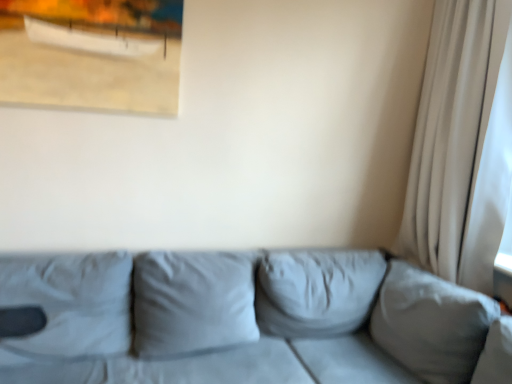
Question: From a real-world perspective, does white sheer curtain at right sit lower than suede gray couch at center?

Choices:
 (A) yes
 (B) no

Answer: (B)

Question: Is white sheer curtain at right in front of suede gray couch at center?

Choices:
 (A) no
 (B) yes

Answer: (A)

Question: From a real-world perspective, is white sheer curtain at right on top of suede gray couch at center?

Choices:
 (A) no
 (B) yes

Answer: (B)

Question: Is white sheer curtain at right far away from suede gray couch at center?

Choices:
 (A) no
 (B) yes

Answer: (A)

Question: Is suede gray couch at center located within white sheer curtain at right?

Choices:
 (A) no
 (B) yes

Answer: (A)

Question: From a real-world perspective, is white sheer curtain at right above or below matte wooden picture frame at upper left?

Choices:
 (A) above
 (B) below

Answer: (B)

Question: Do you think white sheer curtain at right is within matte wooden picture frame at upper left, or outside of it?

Choices:
 (A) inside
 (B) outside

Answer: (B)

Question: Considering the positions of point (467, 172) and point (108, 44), is point (467, 172) closer or farther from the camera than point (108, 44)?

Choices:
 (A) farther
 (B) closer

Answer: (A)

Question: Relative to matte wooden picture frame at upper left, is white sheer curtain at right in front or behind?

Choices:
 (A) behind
 (B) front

Answer: (B)

Question: Is suede gray couch at center to the left or to the right of white sheer curtain at right in the image?

Choices:
 (A) right
 (B) left

Answer: (B)

Question: From a real-world perspective, is suede gray couch at center positioned above or below white sheer curtain at right?

Choices:
 (A) above
 (B) below

Answer: (B)

Question: Looking at the image, does suede gray couch at center seem bigger or smaller compared to white sheer curtain at right?

Choices:
 (A) small
 (B) big

Answer: (B)

Question: From the image's perspective, is suede gray couch at center positioned above or below white sheer curtain at right?

Choices:
 (A) below
 (B) above

Answer: (A)

Question: Is matte wooden picture frame at upper left in front of or behind suede gray couch at center in the image?

Choices:
 (A) front
 (B) behind

Answer: (B)

Question: Is point (44, 104) closer or farther from the camera than point (124, 251)?

Choices:
 (A) closer
 (B) farther

Answer: (A)